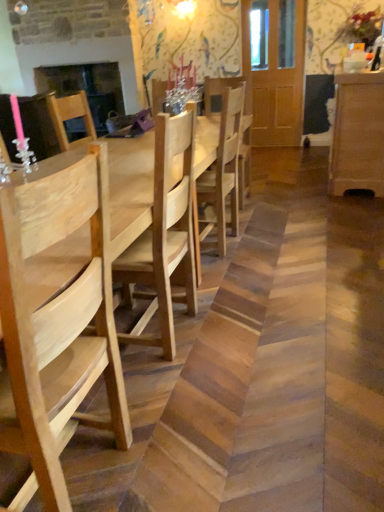
Question: Can you confirm if natural wood chair at center, marked as the 1th chair in a back-to-front arrangement, is positioned to the right of light brown wood dresser at right?

Choices:
 (A) no
 (B) yes

Answer: (A)

Question: Could you tell me if natural wood chair at center, marked as the 1th chair in a back-to-front arrangement, is facing light brown wood dresser at right?

Choices:
 (A) yes
 (B) no

Answer: (B)

Question: Is natural wood chair at center, marked as the 1th chair in a back-to-front arrangement, not within light brown wood dresser at right?

Choices:
 (A) yes
 (B) no

Answer: (A)

Question: Are natural wood chair at center, which appears as the 1th chair when viewed from the right, and light brown wood dresser at right beside each other?

Choices:
 (A) no
 (B) yes

Answer: (A)

Question: Can you confirm if natural wood chair at center, marked as the second chair in a front-to-back arrangement, is wider than light brown wood dresser at right?

Choices:
 (A) yes
 (B) no

Answer: (B)

Question: Is natural wood table at center wider or thinner than light brown wood dresser at right?

Choices:
 (A) wide
 (B) thin

Answer: (A)

Question: Is natural wood table at center in front of or behind light brown wood dresser at right in the image?

Choices:
 (A) front
 (B) behind

Answer: (A)

Question: From the image's perspective, is natural wood table at center positioned above or below light brown wood dresser at right?

Choices:
 (A) below
 (B) above

Answer: (A)

Question: Visually, is natural wood table at center positioned to the left or to the right of light brown wood dresser at right?

Choices:
 (A) right
 (B) left

Answer: (B)

Question: From the image's perspective, is natural wood table at center positioned above or below natural wood chair at center, the 2th chair when ordered from back to front?

Choices:
 (A) below
 (B) above

Answer: (B)

Question: From their relative heights in the image, would you say natural wood table at center is taller or shorter than natural wood chair at center, the 2th chair when ordered from right to left?

Choices:
 (A) short
 (B) tall

Answer: (A)

Question: Based on their sizes in the image, would you say natural wood table at center is bigger or smaller than natural wood chair at center, marked as the 1th chair in a front-to-back arrangement?

Choices:
 (A) small
 (B) big

Answer: (B)

Question: From a real-world perspective, relative to natural wood chair at center, the 2th chair when ordered from back to front, is natural wood table at center vertically above or below?

Choices:
 (A) below
 (B) above

Answer: (A)

Question: In the image, is light brown wood dresser at right on the left side or the right side of matte black fireplace at upper left?

Choices:
 (A) right
 (B) left

Answer: (A)

Question: Is light brown wood dresser at right situated inside matte black fireplace at upper left or outside?

Choices:
 (A) inside
 (B) outside

Answer: (B)